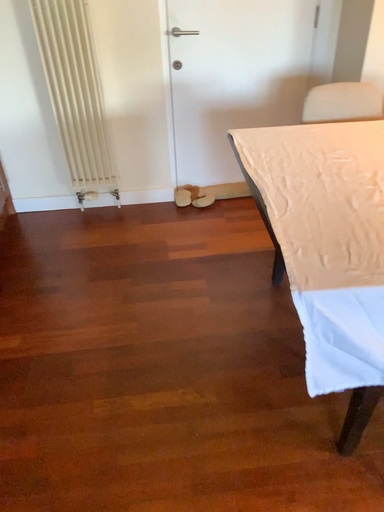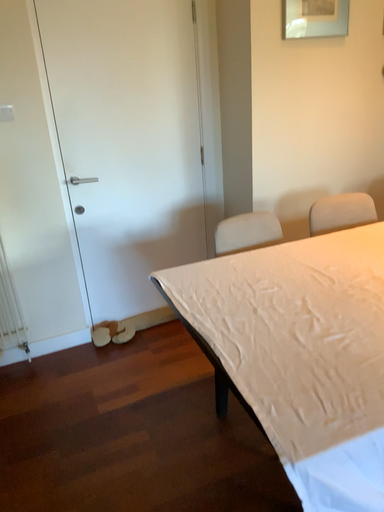
Question: How did the camera likely rotate when shooting the video?

Choices:
 (A) rotated downward
 (B) rotated upward

Answer: (B)